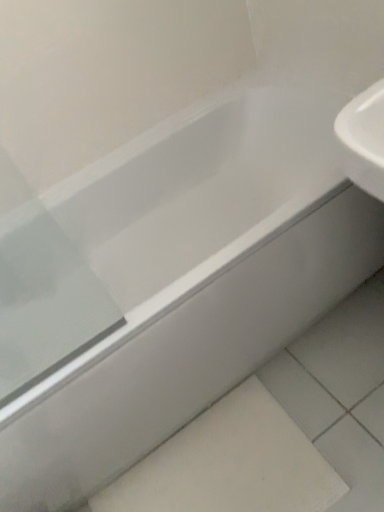
At what (x,y) coordinates should I click in order to perform the action: click on white matte ceramic tile at lower center. Please return your answer as a coordinate pair (x, y). The image size is (384, 512). Looking at the image, I should click on (230, 464).

What do you see at coordinates (230, 464) in the screenshot? Image resolution: width=384 pixels, height=512 pixels. I see `white matte ceramic tile at lower center` at bounding box center [230, 464].

The width and height of the screenshot is (384, 512). What are the coordinates of `white matte ceramic tile at lower center` in the screenshot? It's located at (230, 464).